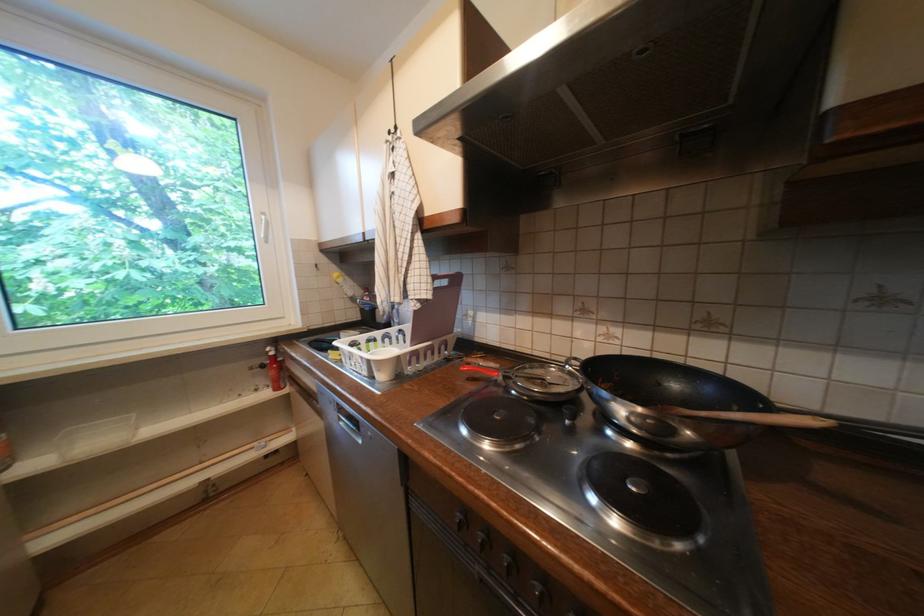
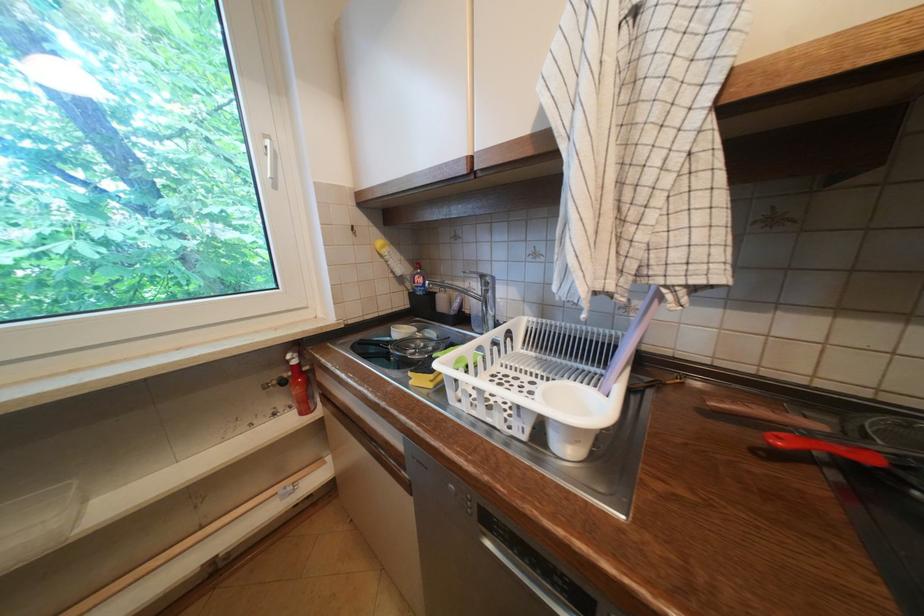
The point at (387, 371) is marked in the first image. Where is the corresponding point in the second image?

(586, 443)